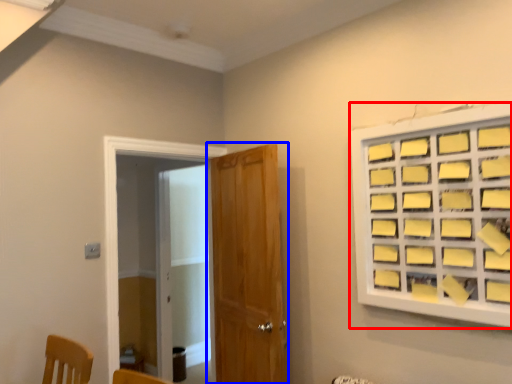
Question: Which of the following is the closest to the observer, window (highlighted by a red box) or door (highlighted by a blue box)?

Choices:
 (A) window
 (B) door

Answer: (A)